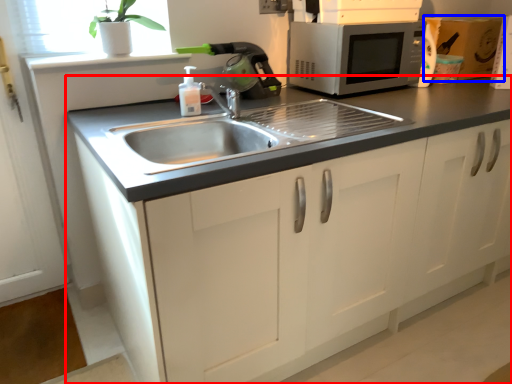
Question: Among these objects, which one is farthest to the camera, cabinetry (highlighted by a red box) or cardboard box (highlighted by a blue box)?

Choices:
 (A) cabinetry
 (B) cardboard box

Answer: (B)